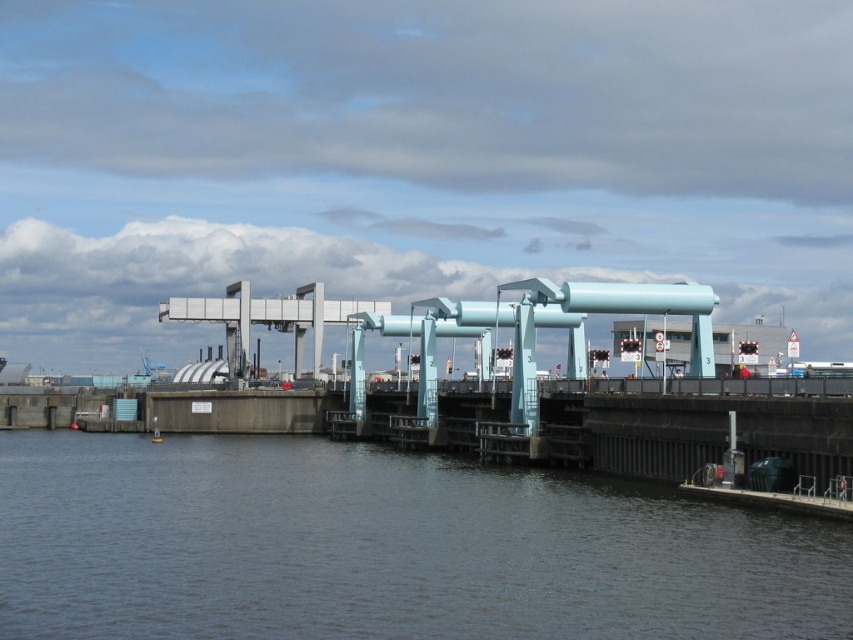
Question: Which object is farther from the camera taking this photo?

Choices:
 (A) dark gray water at lower center
 (B) metallic silver boat at center

Answer: (B)

Question: Can you confirm if dark gray water at lower center is bigger than metallic silver boat at center?

Choices:
 (A) no
 (B) yes

Answer: (B)

Question: Is dark gray water at lower center to the right of metallic silver boat at center from the viewer's perspective?

Choices:
 (A) yes
 (B) no

Answer: (A)

Question: Is dark gray water at lower center to the left of metallic silver boat at center from the viewer's perspective?

Choices:
 (A) yes
 (B) no

Answer: (B)

Question: Which of the following is the farthest from the observer?

Choices:
 (A) (154, 436)
 (B) (784, 604)

Answer: (A)